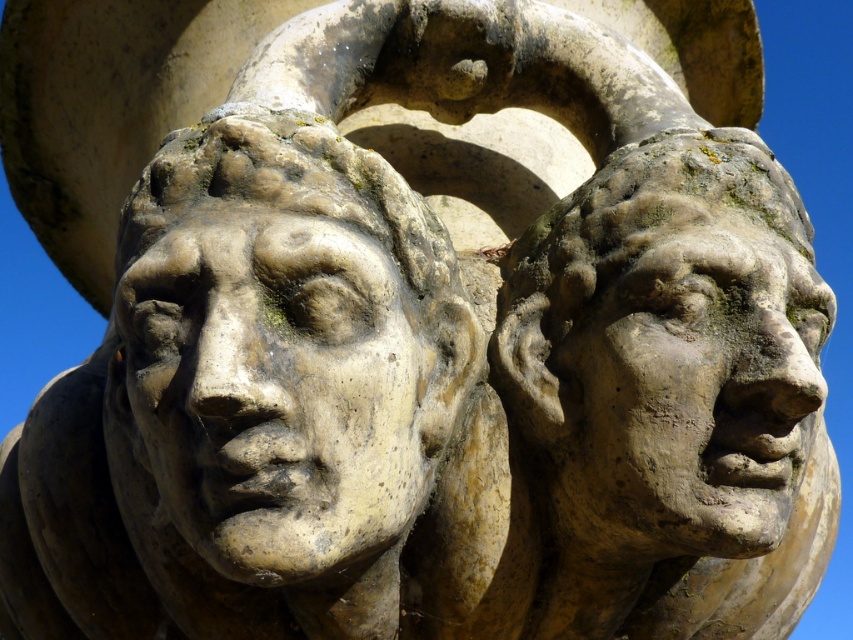
Question: Is stone textured face at center to the right of matte stone face at right from the viewer's perspective?

Choices:
 (A) no
 (B) yes

Answer: (A)

Question: Which point is closer to the camera?

Choices:
 (A) (247, 243)
 (B) (729, 413)

Answer: (A)

Question: Is stone textured face at center positioned before matte stone face at right?

Choices:
 (A) no
 (B) yes

Answer: (B)

Question: Is stone textured face at center to the left of matte stone face at right from the viewer's perspective?

Choices:
 (A) no
 (B) yes

Answer: (B)